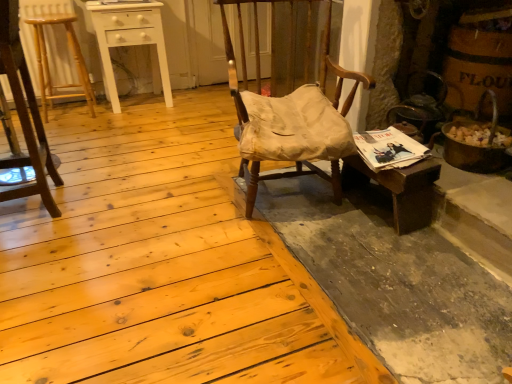
Locate an element on the screen. This screenshot has height=384, width=512. vacant area that is in front of wooden chair with worn fabric cushion at center, the second chair positioned from the left is located at coordinates (289, 258).